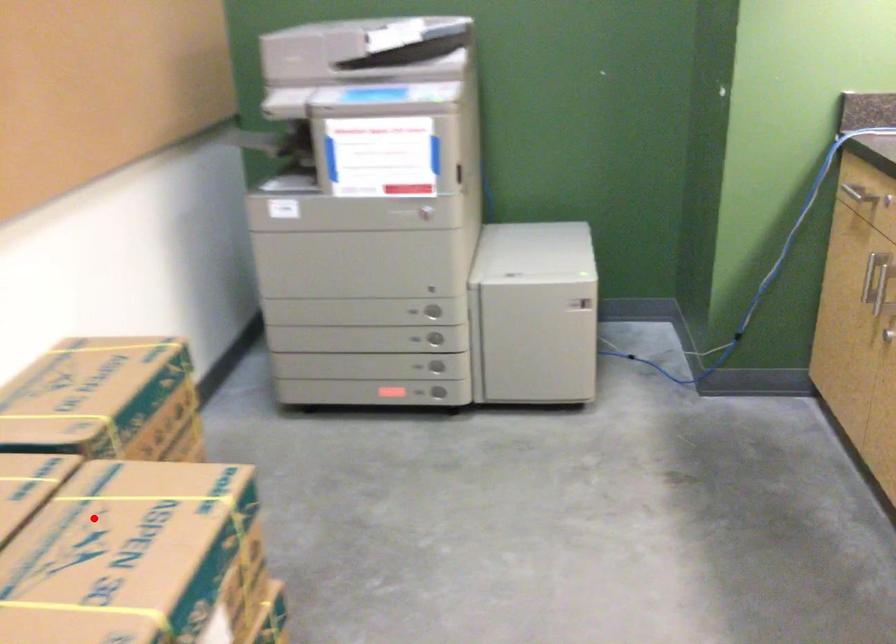
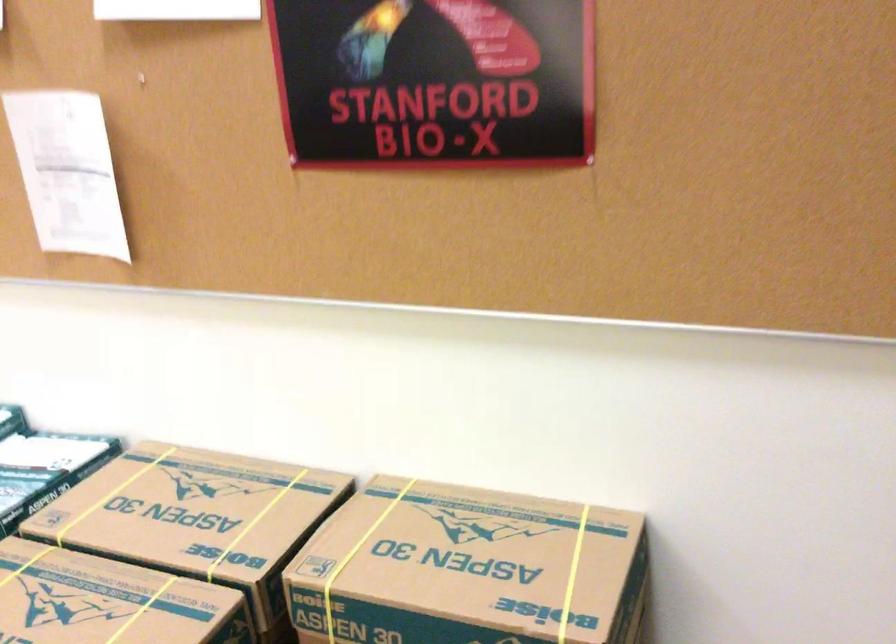
The point at the highlighted location is marked in the first image. Where is the corresponding point in the second image?

(108, 601)